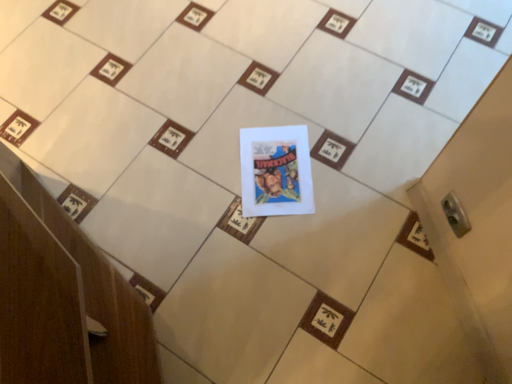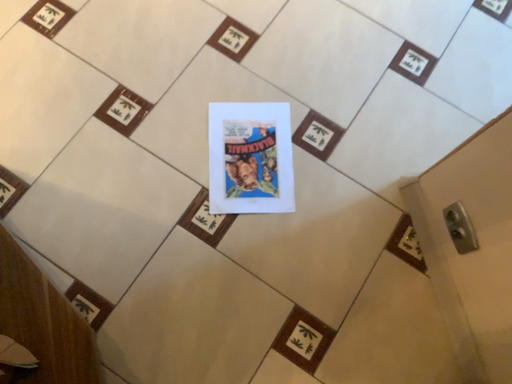
Question: How did the camera likely rotate when shooting the video?

Choices:
 (A) rotated upward
 (B) rotated downward

Answer: (B)